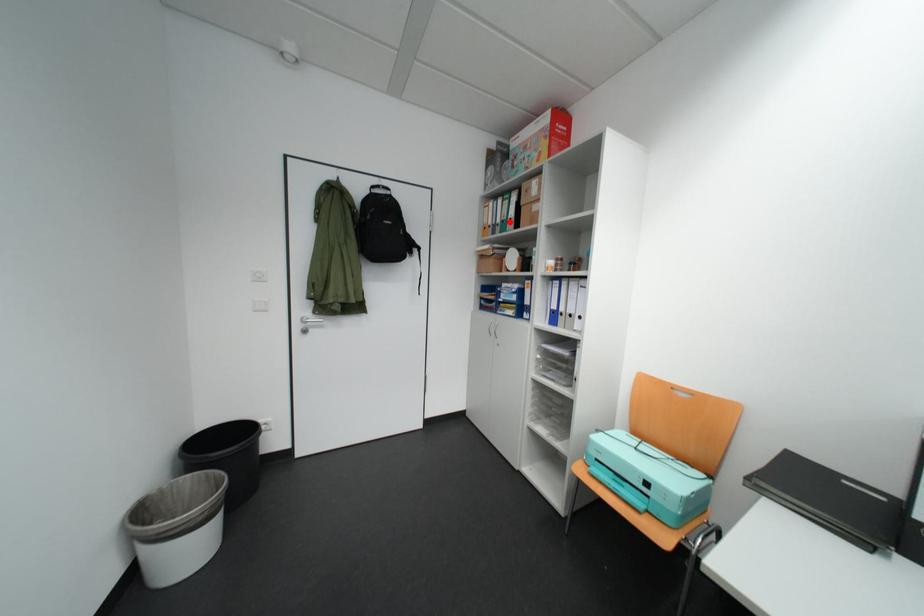
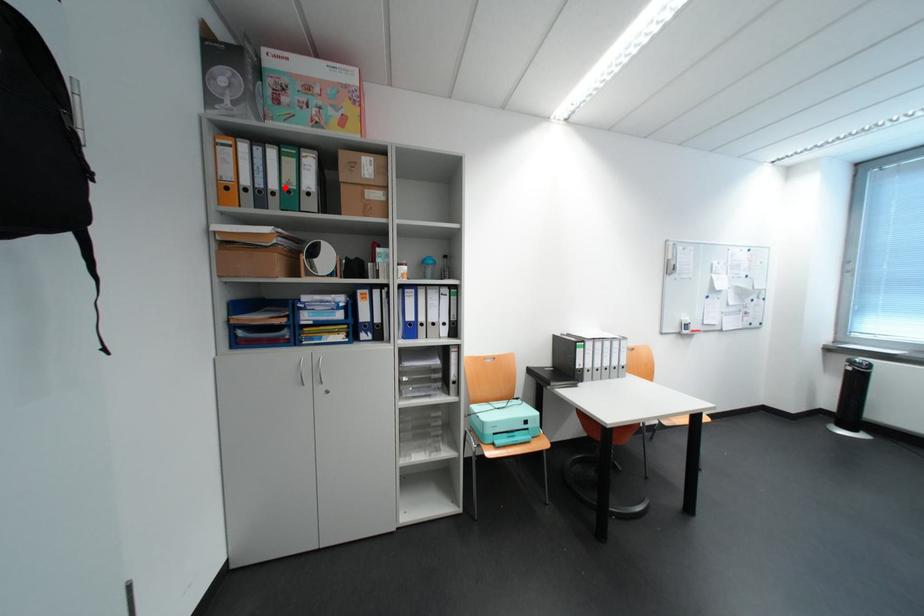
I am providing you with two images of the same scene from different viewpoints. A red point is marked on the first image and another point is marked on the second image. Do the highlighted points in image1 and image2 indicate the same real-world spot?

Yes